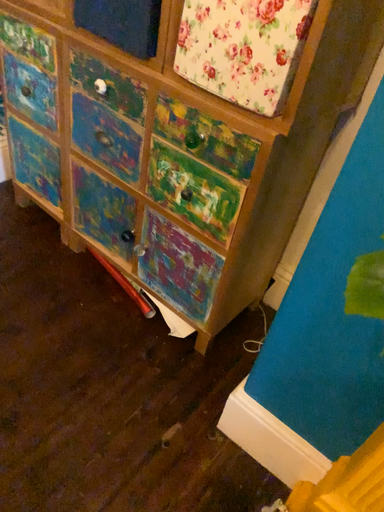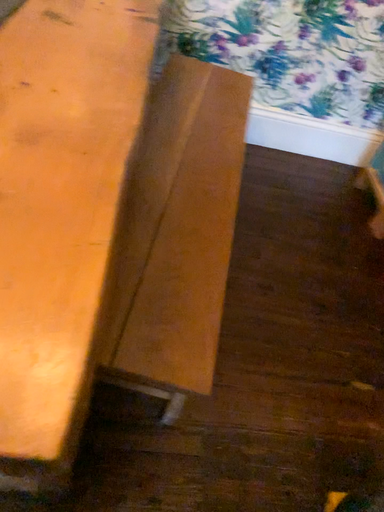
Question: How did the camera likely rotate when shooting the video?

Choices:
 (A) rotated right
 (B) rotated left

Answer: (B)